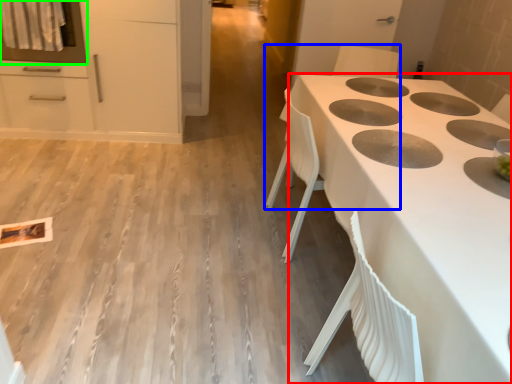
Question: Considering the real-world distances, which object is farthest from countertop (highlighted by a red box)? chair (highlighted by a blue box) or oven (highlighted by a green box)?

Choices:
 (A) chair
 (B) oven

Answer: (B)